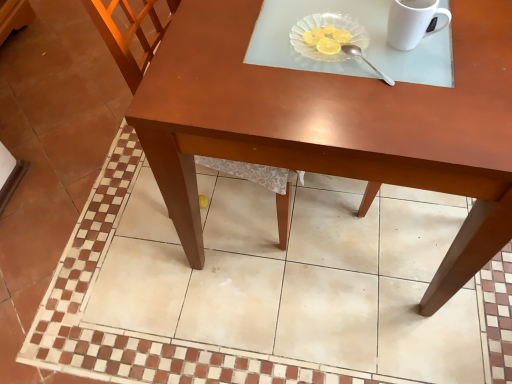
The width and height of the screenshot is (512, 384). Find the location of `vacant area located to the right-hand side of silver metallic spoon at upper center`. vacant area located to the right-hand side of silver metallic spoon at upper center is located at coordinates (441, 62).